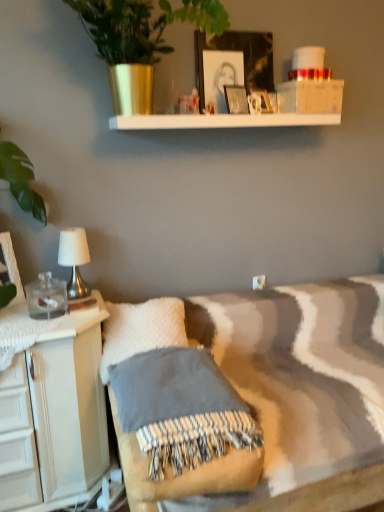
Measure the distance between white fabric-covered lamp at left and camera.

The depth of white fabric-covered lamp at left is 1.86 meters.

What is the approximate height of white fluffy pillow at lower left?

white fluffy pillow at lower left is 12.06 inches in height.

What are the coordinates of `metallic green plant at upper center` in the screenshot? It's located at (139, 41).

Locate an element on the screen. This screenshot has height=512, width=384. matte white picture frame at upper center, positioned as the first picture frame in right-to-left order is located at coordinates (260, 102).

Image resolution: width=384 pixels, height=512 pixels. What do you see at coordinates (12, 266) in the screenshot?
I see `matte white picture frame at left, marked as the 1th picture frame in a bottom-to-top arrangement` at bounding box center [12, 266].

Find the location of `matte white picture frame at left, placed as the 1th picture frame when sorted from left to right`. matte white picture frame at left, placed as the 1th picture frame when sorted from left to right is located at coordinates (12, 266).

At what (x,y) coordinates should I click in order to perform the action: click on white fabric-covered lamp at left. Please return your answer as a coordinate pair (x, y). This screenshot has height=512, width=384. Looking at the image, I should click on (74, 261).

Consider the image. Does metallic green plant at upper center have a greater height compared to matte glass picture frame at upper center, arranged as the third picture frame when viewed from the top?

Indeed, metallic green plant at upper center has a greater height compared to matte glass picture frame at upper center, arranged as the third picture frame when viewed from the top.

Can you confirm if metallic green plant at upper center is wider than matte glass picture frame at upper center, marked as the 2th picture frame in a bottom-to-top arrangement?

Yes, metallic green plant at upper center is wider than matte glass picture frame at upper center, marked as the 2th picture frame in a bottom-to-top arrangement.

Is metallic green plant at upper center aimed at matte glass picture frame at upper center, arranged as the third picture frame when viewed from the top?

No, metallic green plant at upper center is not turned towards matte glass picture frame at upper center, arranged as the third picture frame when viewed from the top.

Is metallic green plant at upper center not near matte glass picture frame at upper center, which ranks as the second picture frame in left-to-right order?

No, metallic green plant at upper center is not far away from matte glass picture frame at upper center, which ranks as the second picture frame in left-to-right order.

From the image's perspective, would you say textured wool blanket at center is shown under matte glass picture frame at upper center, marked as the 2th picture frame in a bottom-to-top arrangement?

Yes.

Would you say textured wool blanket at center contains matte glass picture frame at upper center, which ranks as the second picture frame in left-to-right order?

Actually, matte glass picture frame at upper center, which ranks as the second picture frame in left-to-right order, is outside textured wool blanket at center.

From a real-world perspective, does textured wool blanket at center sit lower than matte glass picture frame at upper center, which ranks as the second picture frame in left-to-right order?

Correct, in the physical world, textured wool blanket at center is lower than matte glass picture frame at upper center, which ranks as the second picture frame in left-to-right order.

Considering the sizes of objects textured wool blanket at center and matte glass picture frame at upper center, arranged as the third picture frame when viewed from the top, in the image provided, who is shorter, textured wool blanket at center or matte glass picture frame at upper center, arranged as the third picture frame when viewed from the top,?

textured wool blanket at center is shorter.

Is the position of matte white picture frame at left, placed as the 1th picture frame when sorted from left to right, more distant than that of metallic green plant at upper center?

Yes, matte white picture frame at left, placed as the 1th picture frame when sorted from left to right, is behind metallic green plant at upper center.

Can you tell me how much matte white picture frame at left, the 4th picture frame from the right, and metallic green plant at upper center differ in facing direction?

The angular difference between matte white picture frame at left, the 4th picture frame from the right, and metallic green plant at upper center is 34.5 degrees.

Does matte white picture frame at left, placed as the 1th picture frame when sorted from left to right, have a greater width compared to metallic green plant at upper center?

Incorrect, the width of matte white picture frame at left, placed as the 1th picture frame when sorted from left to right, does not surpass that of metallic green plant at upper center.

Are metallic green plant at upper center and white fabric-covered lamp at left far apart?

They are positioned close to each other.

Is metallic green plant at upper center positioned before white fabric-covered lamp at left?

Yes, metallic green plant at upper center is closer to the viewer.

From the picture: Would you say metallic green plant at upper center contains white fabric-covered lamp at left?

Definitely not — white fabric-covered lamp at left is not inside metallic green plant at upper center.

Is metallic green plant at upper center facing away from white fabric-covered lamp at left?

metallic green plant at upper center is not turned away from white fabric-covered lamp at left.

Which object is further away from the camera, textured wool blanket at center or matte white picture frame at left, the fourth picture frame positioned from the top?

matte white picture frame at left, the fourth picture frame positioned from the top, is further from the camera.

Is textured wool blanket at center at the left side of matte white picture frame at left, the fourth picture frame positioned from the top?

Incorrect, textured wool blanket at center is not on the left side of matte white picture frame at left, the fourth picture frame positioned from the top.

From a real-world perspective, is textured wool blanket at center physically located above or below matte white picture frame at left, the fourth picture frame positioned from the top?

From a real-world perspective, textured wool blanket at center is physically below matte white picture frame at left, the fourth picture frame positioned from the top.

Consider the image. From a real-world perspective, does matte white picture frame at upper center, positioned as the first picture frame in right-to-left order, sit lower than matte white picture frame at left, the fourth picture frame positioned from the top?

No, from a real-world perspective, matte white picture frame at upper center, positioned as the first picture frame in right-to-left order, is not under matte white picture frame at left, the fourth picture frame positioned from the top.

Is matte white picture frame at upper center, marked as the 2th picture frame in a top-to-bottom arrangement, positioned beyond the bounds of matte white picture frame at left, the 4th picture frame from the right?

That's correct, matte white picture frame at upper center, marked as the 2th picture frame in a top-to-bottom arrangement, is outside of matte white picture frame at left, the 4th picture frame from the right.

Between matte white picture frame at upper center, which ranks as the 4th picture frame in left-to-right order, and matte white picture frame at left, marked as the 1th picture frame in a bottom-to-top arrangement, which one appears on the left side from the viewer's perspective?

Positioned to the left is matte white picture frame at left, marked as the 1th picture frame in a bottom-to-top arrangement.

Can you confirm if matte white picture frame at upper center, positioned as the first picture frame in right-to-left order, is smaller than matte white picture frame at left, the fourth picture frame positioned from the top?

Indeed, matte white picture frame at upper center, positioned as the first picture frame in right-to-left order, has a smaller size compared to matte white picture frame at left, the fourth picture frame positioned from the top.

Considering their positions, is white fluffy pillow at lower left located in front of or behind white fabric-covered lamp at left?

In the image, white fluffy pillow at lower left appears in front of white fabric-covered lamp at left.

Looking at this image, choose the correct answer: Is white fluffy pillow at lower left inside white fabric-covered lamp at left or outside it?

white fluffy pillow at lower left lies outside white fabric-covered lamp at left.

Does white fluffy pillow at lower left appear on the right side of white fabric-covered lamp at left?

Yes.

I want to click on the 3rd picture frame directly beneath the metallic green plant at upper center (from a real-world perspective), so click(236, 99).

The width and height of the screenshot is (384, 512). There is a textured wool blanket at center. Find the location of `the 2nd picture frame above it (from a real-world perspective)`. the 2nd picture frame above it (from a real-world perspective) is located at coordinates (236, 99).

Based on their spatial positions, is metallic green plant at upper center or white fabric-covered lamp at left closer to white fluffy pillow at lower left?

Among the two, white fabric-covered lamp at left is located nearer to white fluffy pillow at lower left.

Considering their positions, is metallic green plant at upper center positioned further to matte white picture frame at upper center, marked as the 2th picture frame in a top-to-bottom arrangement, than white fabric-covered lamp at left?

white fabric-covered lamp at left.

Looking at the image, which one is located closer to matte black picture frame at upper center, which is the second picture frame from right to left, textured wool blanket at center or white fabric-covered lamp at left?

white fabric-covered lamp at left is positioned closer to the anchor matte black picture frame at upper center, which is the second picture frame from right to left.

In the scene shown: Looking at the image, which one is located closer to white fluffy pillow at lower left, matte black picture frame at upper center, which is the second picture frame from right to left, or matte glass picture frame at upper center, arranged as the third picture frame when viewed from the top?

matte glass picture frame at upper center, arranged as the third picture frame when viewed from the top, lies closer to white fluffy pillow at lower left than the other object.

When comparing their distances from matte glass picture frame at upper center, marked as the 2th picture frame in a bottom-to-top arrangement, does white fabric-covered lamp at left or matte white picture frame at upper center, positioned as the first picture frame in right-to-left order, seem closer?

matte white picture frame at upper center, positioned as the first picture frame in right-to-left order, is closer to matte glass picture frame at upper center, marked as the 2th picture frame in a bottom-to-top arrangement.

Looking at the image, which one is located closer to metallic green plant at upper center, matte glass picture frame at upper center, arranged as the third picture frame when viewed from the top, or white fabric-covered lamp at left?

matte glass picture frame at upper center, arranged as the third picture frame when viewed from the top, is positioned closer to the anchor metallic green plant at upper center.

Considering their positions, is textured wool blanket at center positioned further to matte white picture frame at left, marked as the 1th picture frame in a bottom-to-top arrangement, than white fabric-covered lamp at left?

textured wool blanket at center lies further to matte white picture frame at left, marked as the 1th picture frame in a bottom-to-top arrangement, than the other object.

From the image, which object appears to be farther from textured wool blanket at center, metallic green plant at upper center or matte glass picture frame at upper center, which ranks as the second picture frame in left-to-right order?

Among the two, matte glass picture frame at upper center, which ranks as the second picture frame in left-to-right order, is located further to textured wool blanket at center.

The image size is (384, 512). Find the location of `throw pillow located between textured wool blanket at center and white fabric-covered lamp at left in the depth direction`. throw pillow located between textured wool blanket at center and white fabric-covered lamp at left in the depth direction is located at coordinates (141, 330).

Image resolution: width=384 pixels, height=512 pixels. I want to click on throw pillow situated between matte white picture frame at left, marked as the 1th picture frame in a bottom-to-top arrangement, and textured wool blanket at center from left to right, so click(x=141, y=330).

Image resolution: width=384 pixels, height=512 pixels. Find the location of `table lamp that lies between matte white picture frame at upper center, marked as the 2th picture frame in a top-to-bottom arrangement, and textured wool blanket at center from top to bottom`. table lamp that lies between matte white picture frame at upper center, marked as the 2th picture frame in a top-to-bottom arrangement, and textured wool blanket at center from top to bottom is located at coordinates (74, 261).

Identify the location of table lamp between matte white picture frame at left, marked as the 1th picture frame in a bottom-to-top arrangement, and matte white picture frame at upper center, positioned as the first picture frame in right-to-left order, in the horizontal direction. (74, 261).